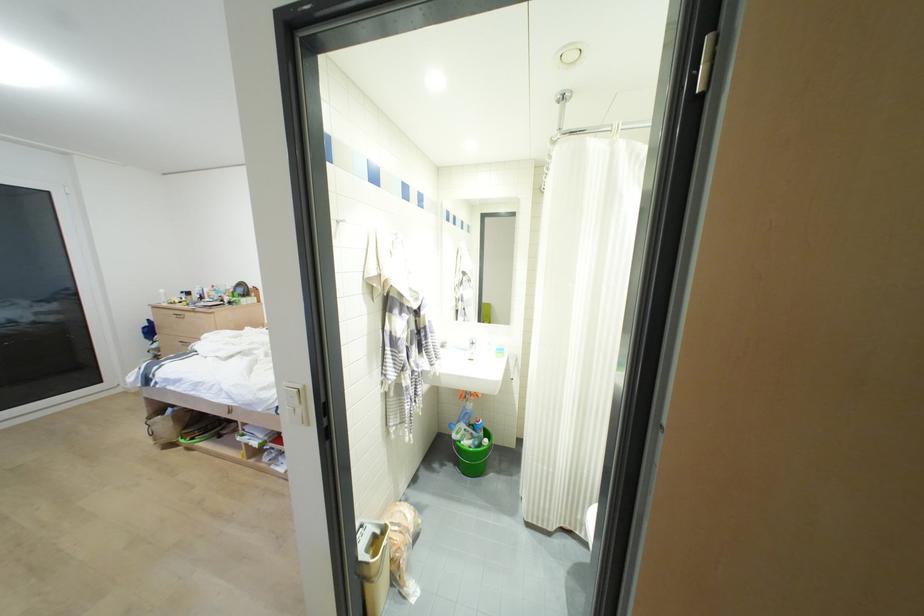
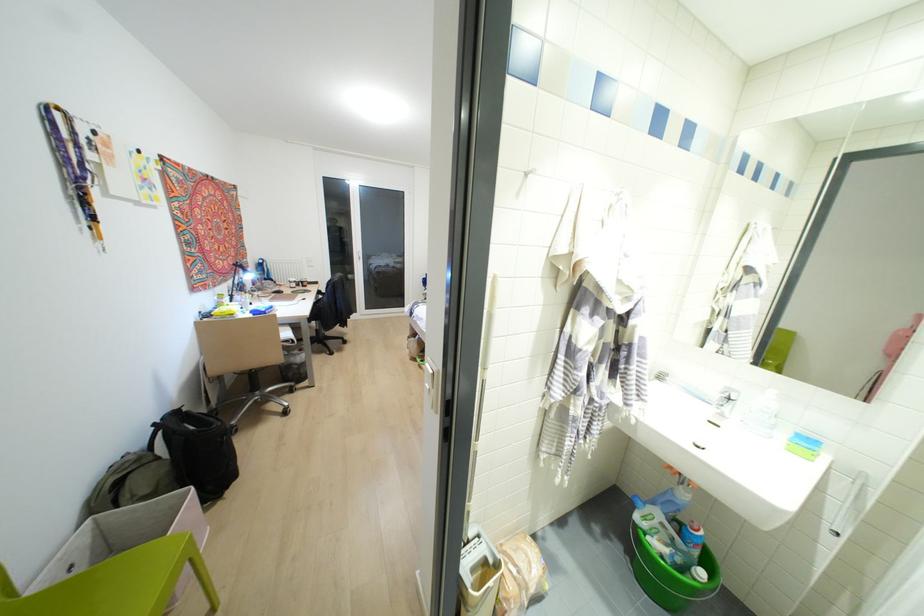
Where in the second image is the point corresponding to pixel 500 350 from the first image?

(807, 440)